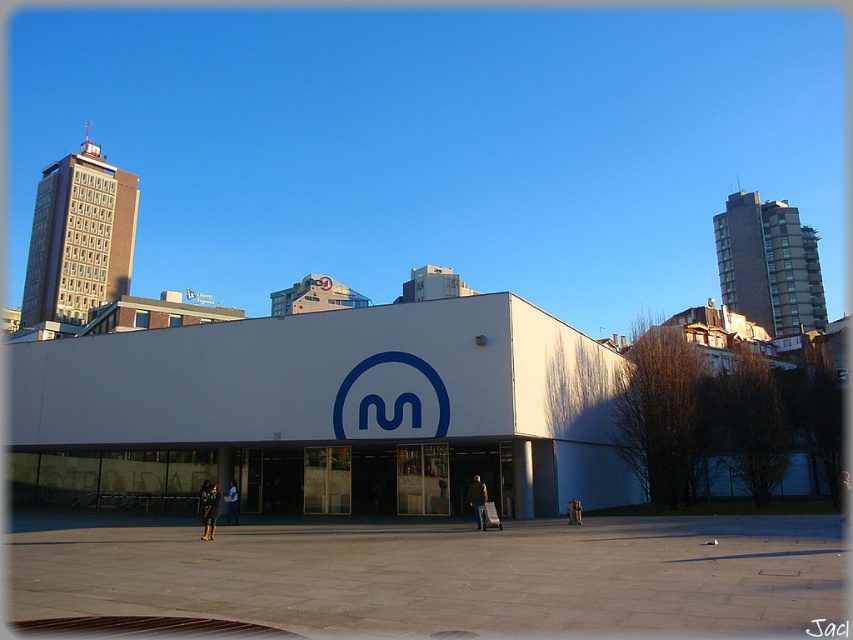
Is white smooth building at center behind dark green fabric jacket at center?

No, it is not.

Does white smooth building at center appear on the left side of dark green fabric jacket at center?

Yes, white smooth building at center is to the left of dark green fabric jacket at center.

The height and width of the screenshot is (640, 853). What do you see at coordinates (328, 410) in the screenshot?
I see `white smooth building at center` at bounding box center [328, 410].

Where is `white smooth building at center`? white smooth building at center is located at coordinates click(x=328, y=410).

Who is more forward, (x=202, y=500) or (x=228, y=493)?

Point (x=202, y=500)

Can you confirm if dark blue leather jacket at center is smaller than dark green fabric jacket at center?

No, dark blue leather jacket at center is not smaller than dark green fabric jacket at center.

Is point (216, 513) closer to camera compared to point (228, 524)?

Yes.

Image resolution: width=853 pixels, height=640 pixels. I want to click on dark blue leather jacket at center, so click(209, 508).

Does dark blue leather jacket at center lie in front of light brown leather jacket at center?

Yes, it is.

Which is in front, point (206, 481) or point (483, 525)?

Point (483, 525) is more forward.

The width and height of the screenshot is (853, 640). Find the location of `dark blue leather jacket at center`. dark blue leather jacket at center is located at coordinates (209, 508).